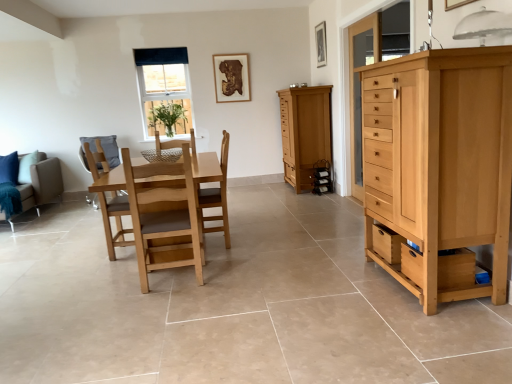
Question: From the image's perspective, is light brown wood chair at center, which ranks as the second chair in left-to-right order, above or below wooden drawer at lower right?

Choices:
 (A) above
 (B) below

Answer: (A)

Question: Is light brown wood chair at center, which ranks as the second chair in left-to-right order, in front of or behind wooden drawer at lower right in the image?

Choices:
 (A) behind
 (B) front

Answer: (A)

Question: Based on their relative distances, which object is farther from the light brown wooden swivel chair at center-left?

Choices:
 (A) wooden drawer at lower right
 (B) clear glass window at upper center
 (C) brown fabric couch at left
 (D) transparent glass cabinet at right
 (E) matte wood cabinet at center

Answer: (A)

Question: Based on their relative distances, which object is farther from the light brown wood chair at center, the 1th chair positioned from the right?

Choices:
 (A) light brown wooden swivel chair at center-left
 (B) transparent glass cabinet at right
 (C) clear glass window at upper center
 (D) wooden picture frame at upper center, placed as the second picture frame when sorted from left to right
 (E) matte wood cabinet at center

Answer: (D)